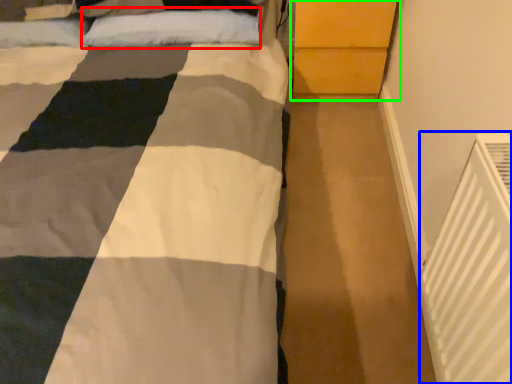
Question: Which is nearer to the pillow (highlighted by a red box)? air conditioning (highlighted by a blue box) or dresser (highlighted by a green box).

Choices:
 (A) air conditioning
 (B) dresser

Answer: (B)